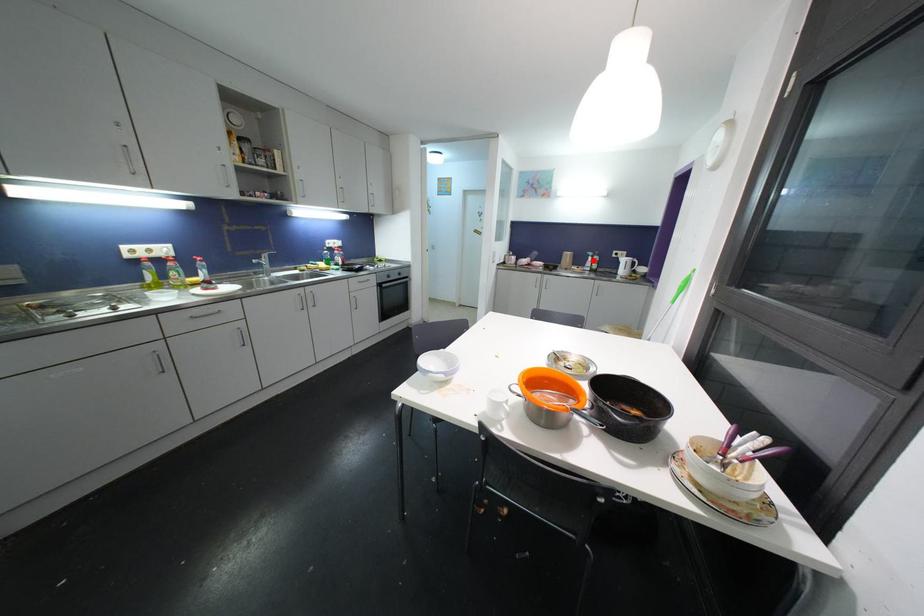
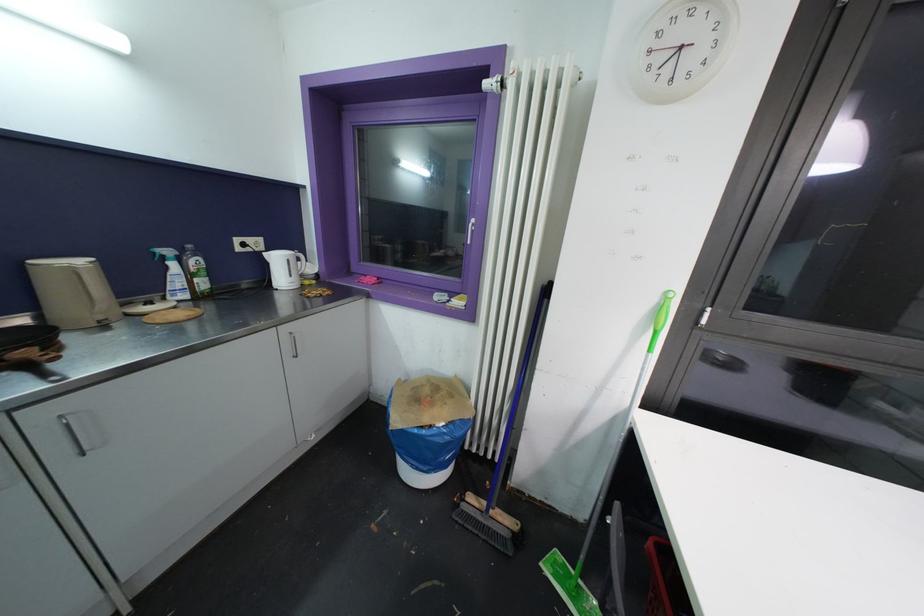
Question: I am providing you with two images of the same scene from different viewpoints. Image1 has a red point marked. In image2, the corresponding 3D location appears at what relative position? Reply with the corresponding letter.

Choices:
 (A) Closer
 (B) Farther

Answer: (B)